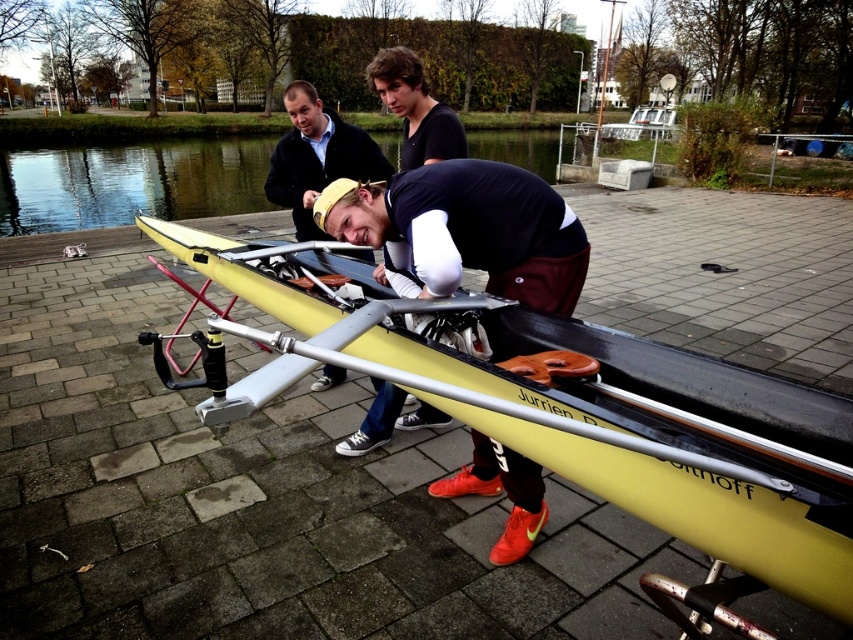
Question: Estimate the real-world distances between objects in this image. Which object is farther from the yellow matte boat at center?

Choices:
 (A) matte black rowing boat at center
 (B) clear water at center

Answer: (B)

Question: From the image, what is the correct spatial relationship of yellow matte boat at center in relation to clear water at center?

Choices:
 (A) below
 (B) above

Answer: (A)

Question: Where is matte black rowing boat at center located in relation to clear water at center in the image?

Choices:
 (A) above
 (B) below

Answer: (B)

Question: Which point is farther to the camera?

Choices:
 (A) (392, 189)
 (B) (218, 176)

Answer: (B)

Question: Is yellow matte boat at center to the right of clear water at center from the viewer's perspective?

Choices:
 (A) no
 (B) yes

Answer: (B)

Question: Estimate the real-world distances between objects in this image. Which object is closer to the matte black rowing boat at center?

Choices:
 (A) yellow matte boat at center
 (B) clear water at center

Answer: (A)